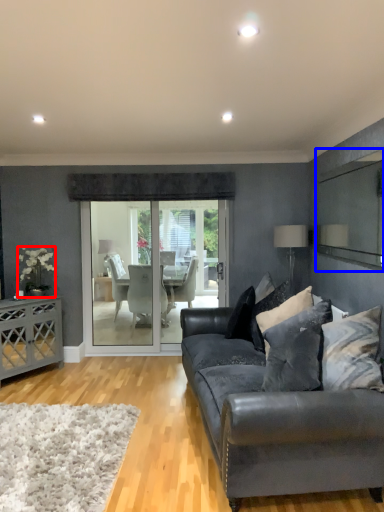
Question: Which of the following is the farthest to the observer, flower (highlighted by a red box) or mirror (highlighted by a blue box)?

Choices:
 (A) flower
 (B) mirror

Answer: (A)